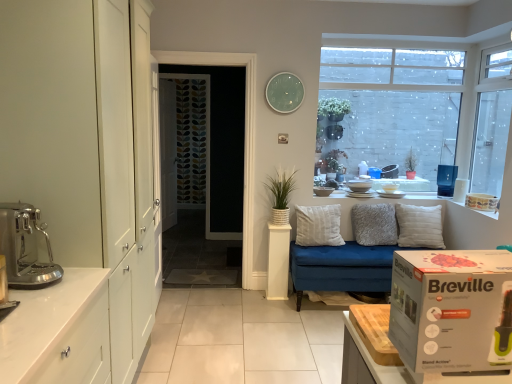
Where is `empty space that is ontop of white textured pillow at center, positioned as the 3th pillow in left-to-right order`? empty space that is ontop of white textured pillow at center, positioned as the 3th pillow in left-to-right order is located at coordinates (424, 200).